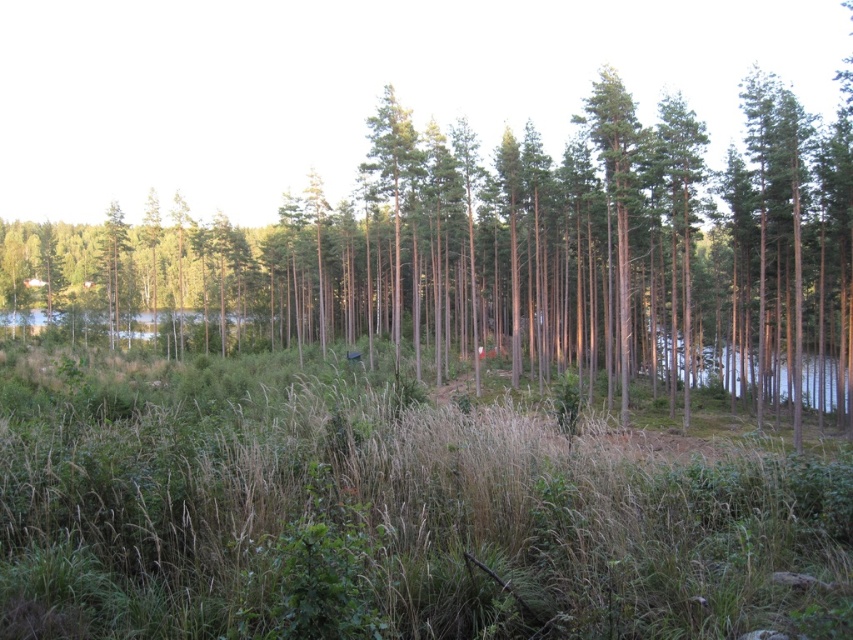
You are a hiker who wants to know if the green grass at center is taller than the green smooth tree at center. Based on the scene, can you determine which is taller?

The green grass at center is smaller than the green smooth tree at center, so the tree is taller.

You are a hiker who wants to take a photo of both the green grass at center and the green smooth tree at center. Which object should you position closer to the camera to ensure both are in focus?

To ensure both the green grass at center and the green smooth tree at center are in focus, position the green grass at center closer to the camera since it is to the left of the green smooth tree at center, allowing for a greater depth of field.

You are standing in the forest and see two points marked in the image. Which point is closer to you, point [598,557] or point [480,285]?

Point [598,557] is in front of point [480,285], so it is closer to you.